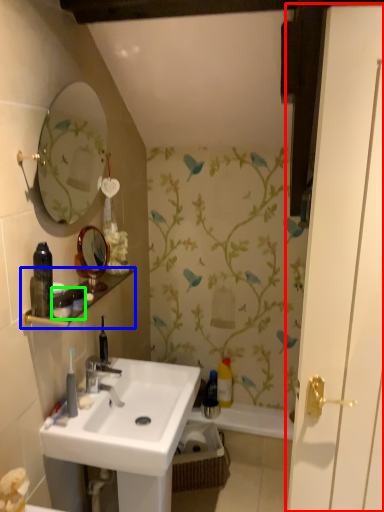
Question: Based on their relative distances, which object is farther from door (highlighted by a red box)? Choose from balustrade (highlighted by a blue box) and toiletry (highlighted by a green box).

Choices:
 (A) balustrade
 (B) toiletry

Answer: (A)